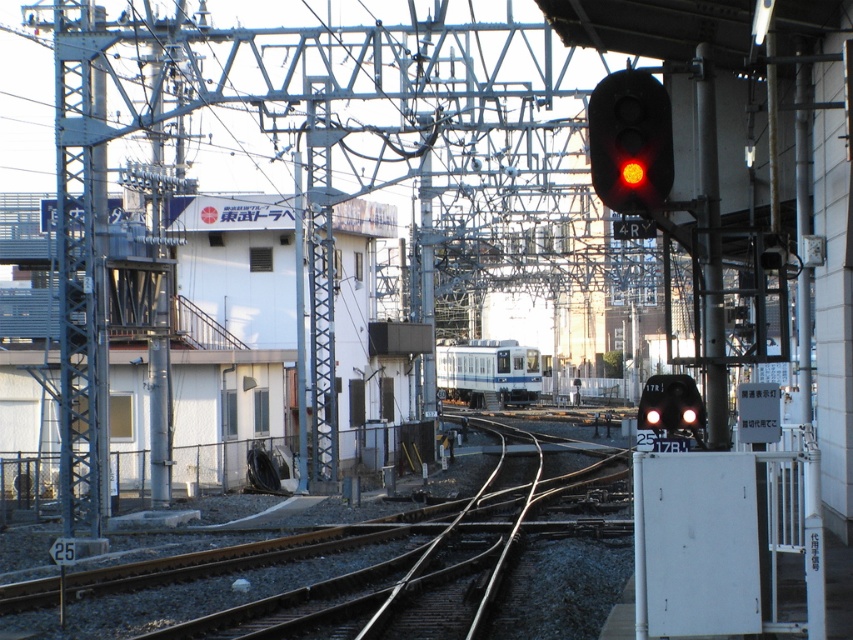
You are standing at the railway station and want to reach a specific point marked at coordinates point (647, 125). If your maximum comfortable walking distance is 10 meters, can you comfortably walk to that point from where you are standing?

The distance of point (647, 125) from viewer is 8.75 meters, so yes, you can comfortably walk to that point since it is within your 10 meters limit.

You are standing at the railway station and looking at the two points marked on the tracks. Which point is nearer to you, point (631,156) or point (646,412)?

Point (631,156) is closer to the viewer than point (646,412).

Consider the image. You are a passenger on the black glossy train at right and you look out the window. Which direction is the matte black signal light at upper right located relative to your current position?

The matte black signal light at upper right is located above the black glossy train at right, so it is positioned above the train in the scene.